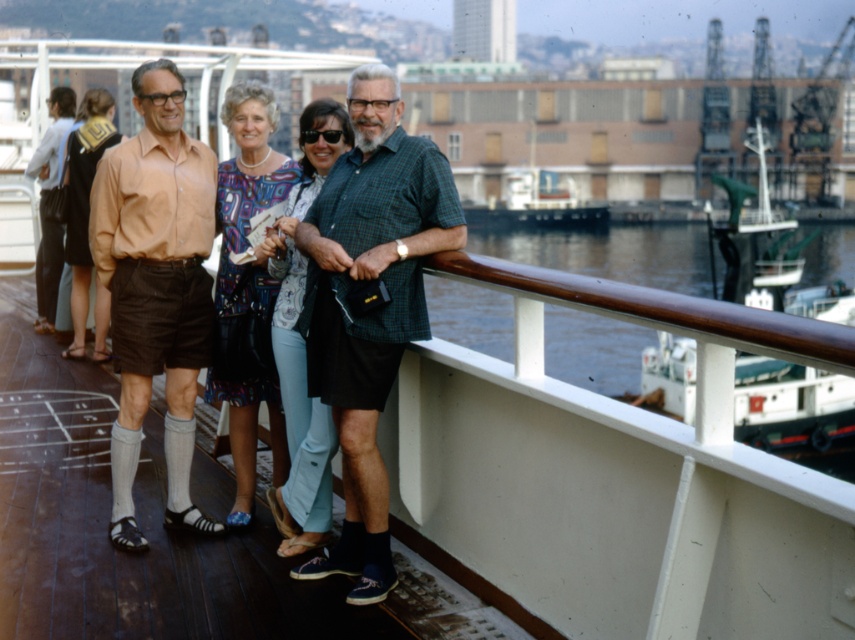
Question: Can you confirm if matte peach shirt at center is wider than brown wooden railing at upper right?

Choices:
 (A) yes
 (B) no

Answer: (B)

Question: Which of these objects is positioned closest to the matte brown dress at left?

Choices:
 (A) white glossy boat at center
 (B) green plaid shirt at center
 (C) matte black shorts at center
 (D) brown wooden railing at upper right

Answer: (C)

Question: Among these points, which one is nearest to the camera?

Choices:
 (A) coord(705,264)
 (B) coord(282,257)
 (C) coord(171,234)

Answer: (B)

Question: Does green plaid shirt at center have a larger size compared to printed silk dress at center?

Choices:
 (A) no
 (B) yes

Answer: (B)

Question: Which of these objects is positioned farthest from the matte peach shirt at center?

Choices:
 (A) brown wooden railing at upper right
 (B) matte black shorts at center
 (C) matte blue jeans at center

Answer: (A)

Question: Does printed silk dress at center have a greater width compared to matte brown dress at left?

Choices:
 (A) no
 (B) yes

Answer: (A)